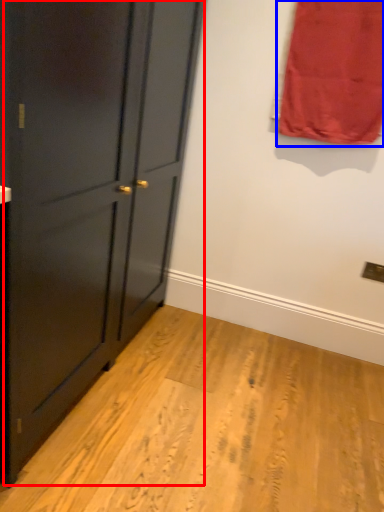
Question: Among these objects, which one is nearest to the camera, door (highlighted by a red box) or curtain (highlighted by a blue box)?

Choices:
 (A) door
 (B) curtain

Answer: (A)